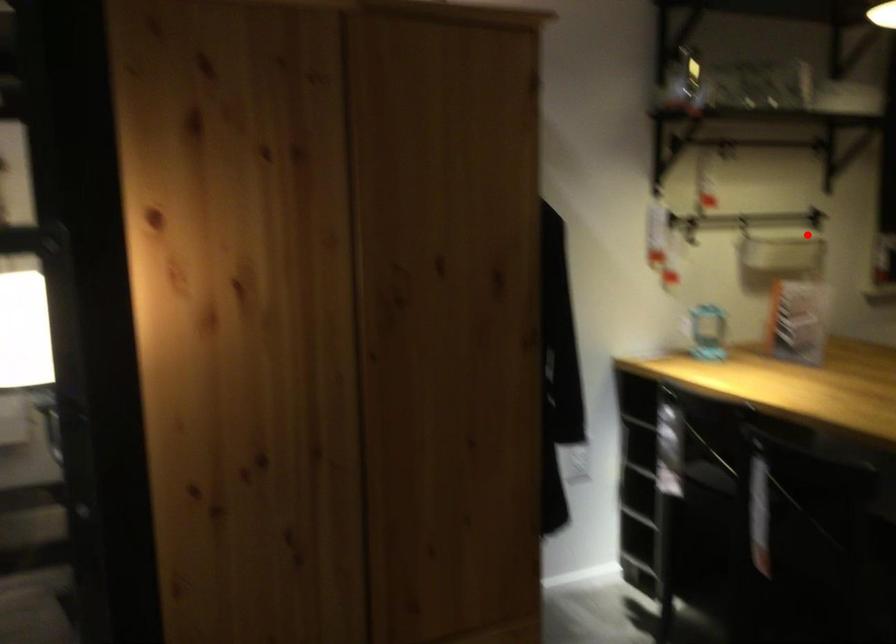
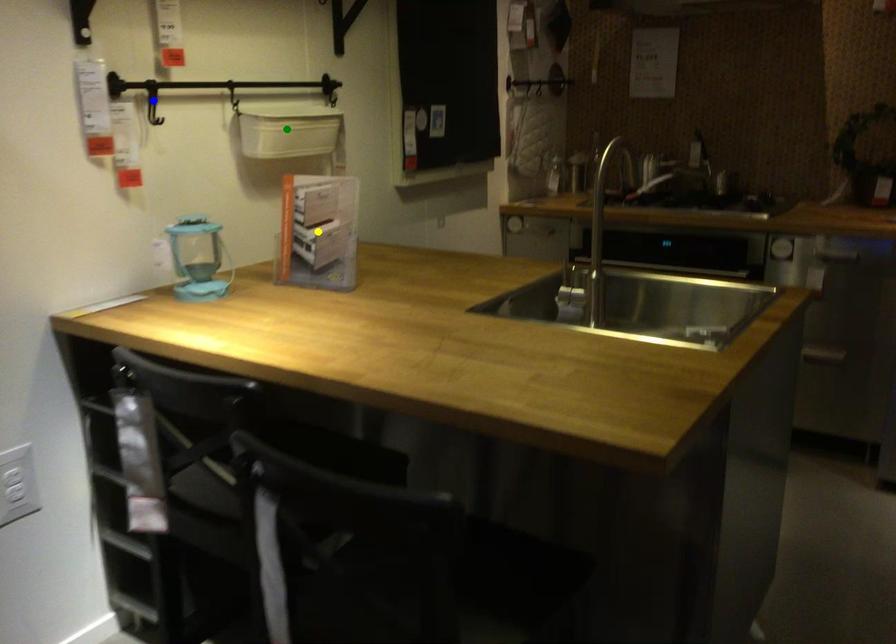
Question: I am providing you with two images of the same scene from different viewpoints. A red point is marked on the first image. You are given multiple points on the second image. Which point in image 2 is actually the same real-world point as the red point in image 1?

Choices:
 (A) yellow point
 (B) blue point
 (C) green point

Answer: (C)